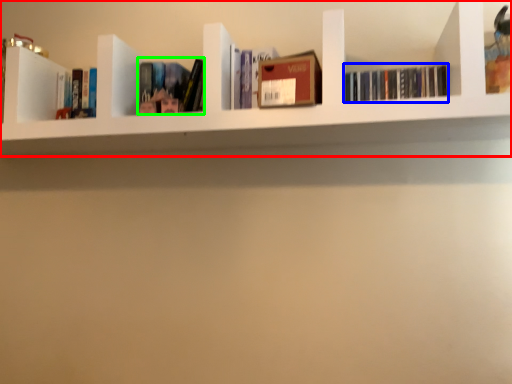
Question: Which object is positioned closest to shelf (highlighted by a red box)? Select from book (highlighted by a blue box) and book (highlighted by a green box).

Choices:
 (A) book
 (B) book

Answer: (B)